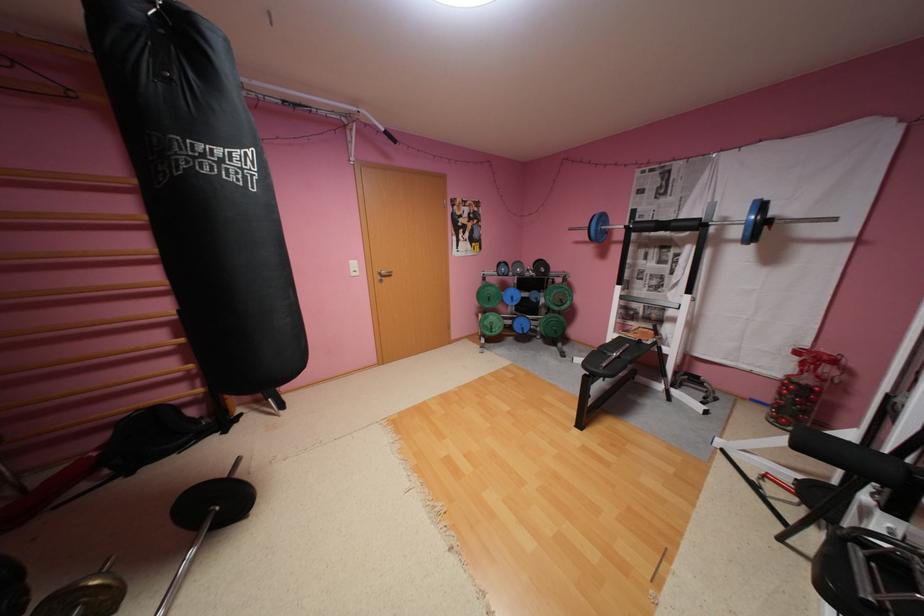
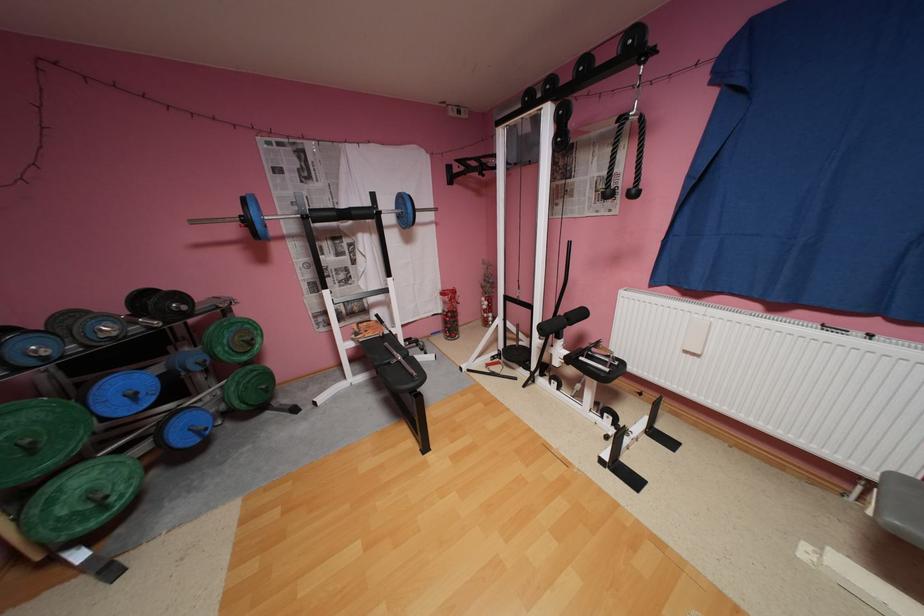
Where in the second image is the point corresponding to [640,336] from the first image?

(380, 334)